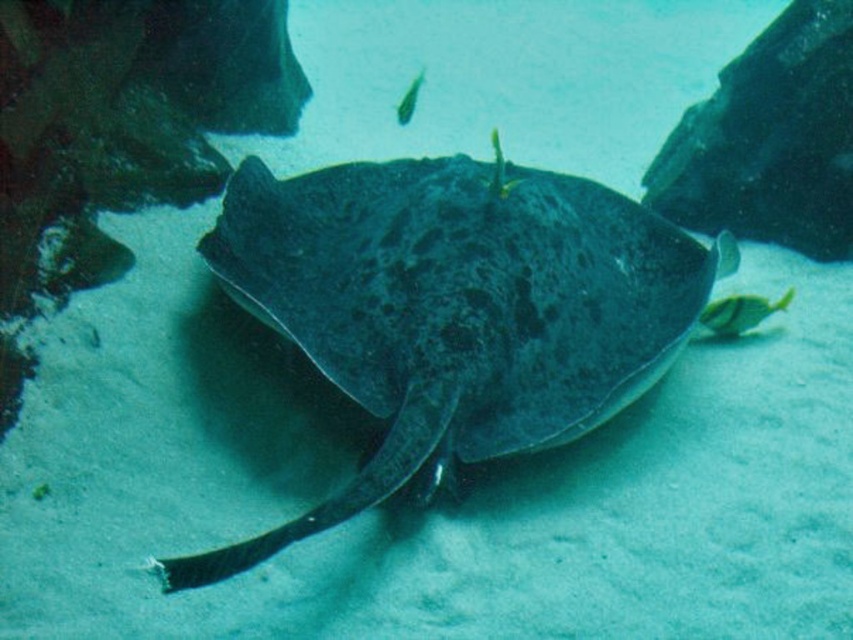
You are a scuba diver swimming in the ocean and see the dark gray textured stingray at center and the green glossy fish at upper center. Which one is located to the right of the other?

The dark gray textured stingray at center is positioned on the right side of green glossy fish at upper center.

You are a marine biologist observing this underwater scene. You notice the dark gray textured stingray at center and the green glossy fish at upper center. Which of these two has a larger height?

The dark gray textured stingray at center has a greater height compared to the green glossy fish at upper center.

You are a marine biologist observing this underwater scene. You notice the shiny yellow fish at center and the green glossy fish at upper center. Which fish is positioned closer to you?

The shiny yellow fish at center is closer to the viewer than the green glossy fish at upper center.